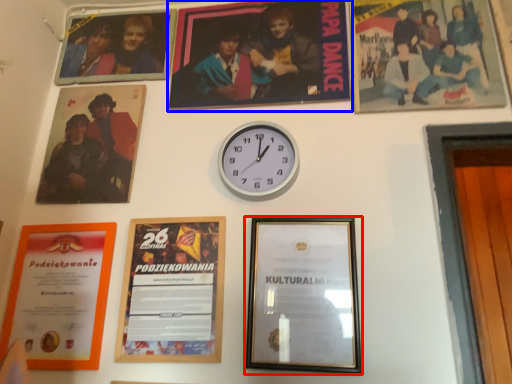
Question: Among these objects, which one is farthest to the camera, picture frame (highlighted by a red box) or picture frame (highlighted by a blue box)?

Choices:
 (A) picture frame
 (B) picture frame

Answer: (B)